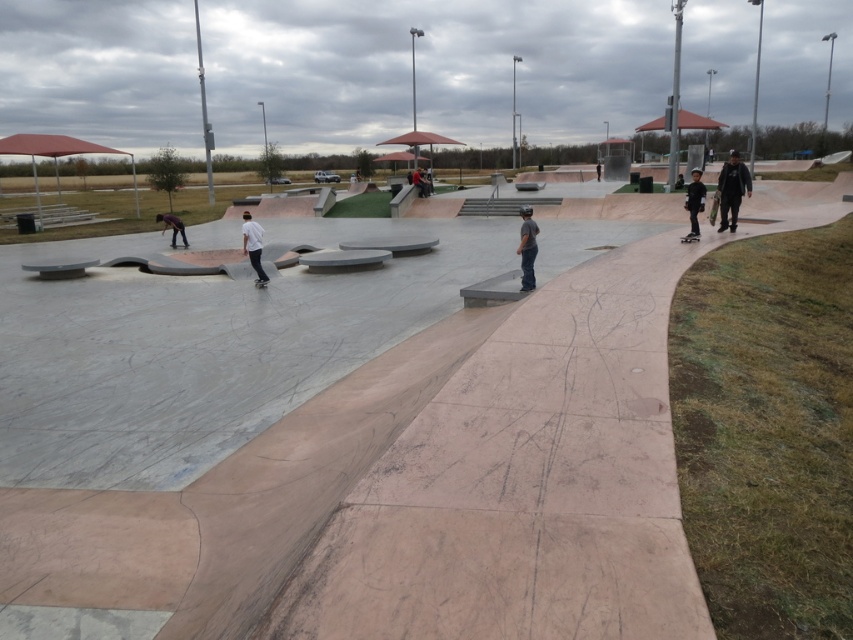
Question: Is black matte skateboard at right below matte black skateboard at center?

Choices:
 (A) no
 (B) yes

Answer: (B)

Question: Which object appears closest to the camera in this image?

Choices:
 (A) shiny purple skateboard at lower left
 (B) white matte shirt at center
 (C) dark gray jacket at upper right
 (D) matte black skateboard at center

Answer: (C)

Question: Among these points, which one is farthest from the camera?

Choices:
 (A) (722, 209)
 (B) (689, 220)
 (C) (421, 186)
 (D) (517, 250)

Answer: (C)

Question: Does black smooth skateboard at center have a lesser width compared to white glossy skateboard at center?

Choices:
 (A) yes
 (B) no

Answer: (B)

Question: Which of the following is the closest to the observer?

Choices:
 (A) (695, 168)
 (B) (422, 177)

Answer: (A)

Question: Is shiny purple skateboard at lower left smaller than black smooth skateboard at center?

Choices:
 (A) yes
 (B) no

Answer: (B)